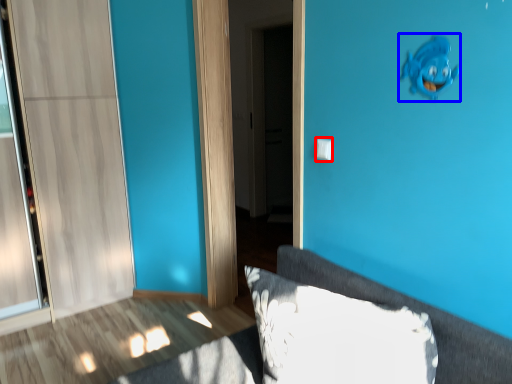
Question: Which of the following is the closest to the observer, light switch (highlighted by a red box) or animal (highlighted by a blue box)?

Choices:
 (A) light switch
 (B) animal

Answer: (B)